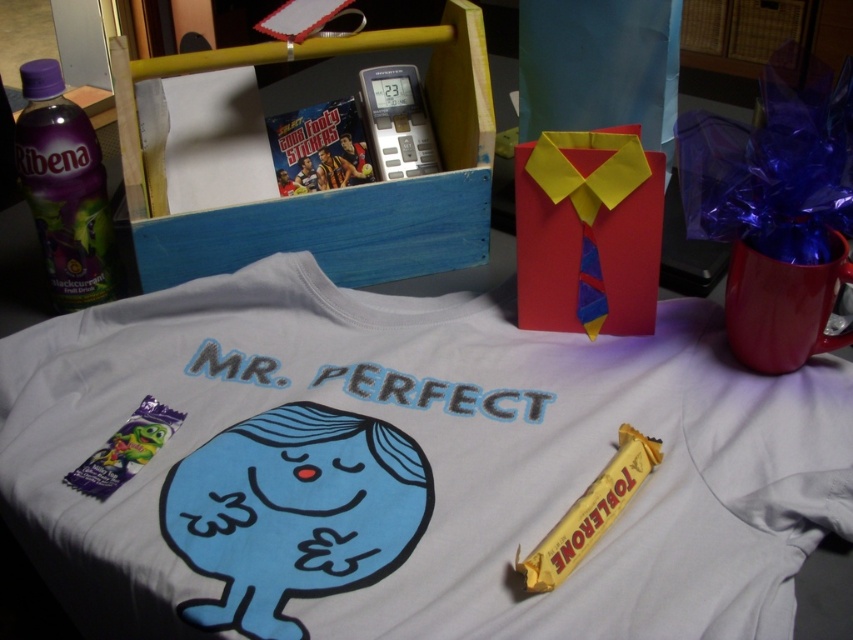
Measure the distance from white cotton t-shirt at center to purple plastic bottle at left.

white cotton t-shirt at center is 32.68 centimeters away from purple plastic bottle at left.

Is point (781, 556) behind point (68, 301)?

No.

Is point (521, 362) less distant than point (55, 90)?

No, (521, 362) is further to viewer.

You are a GUI agent. You are given a task and a screenshot of the screen. Output one action in this format:
    pyautogui.click(x=<x>, y=<y>)
    Task: Click on the white cotton t-shirt at center
    The image size is (853, 640).
    Given the screenshot: What is the action you would take?
    pyautogui.click(x=410, y=467)